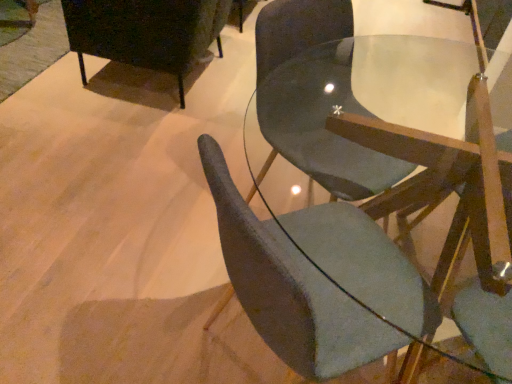
Where is `free space to the left of matte gray chair at center, placed as the third chair when sorted from left to right`? This screenshot has width=512, height=384. free space to the left of matte gray chair at center, placed as the third chair when sorted from left to right is located at coordinates (127, 248).